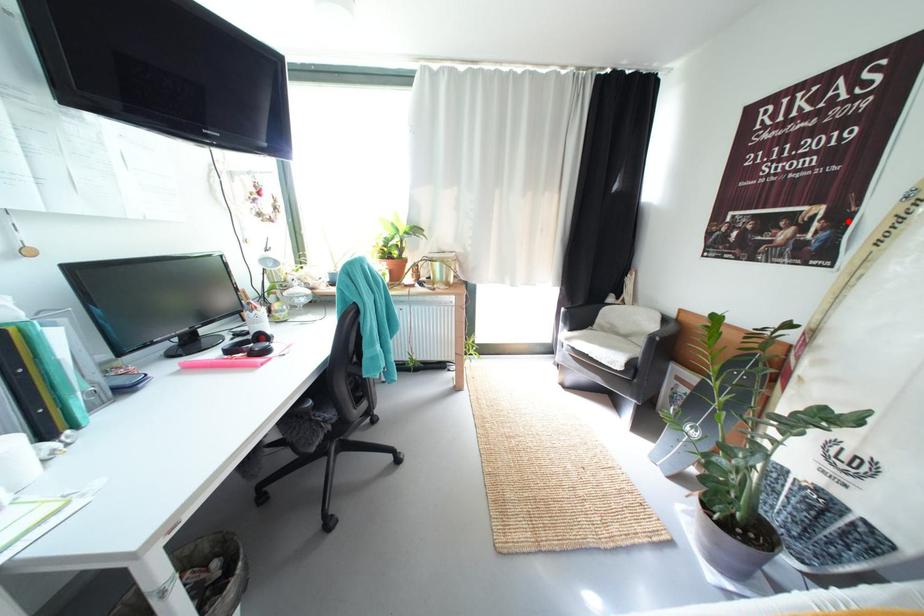
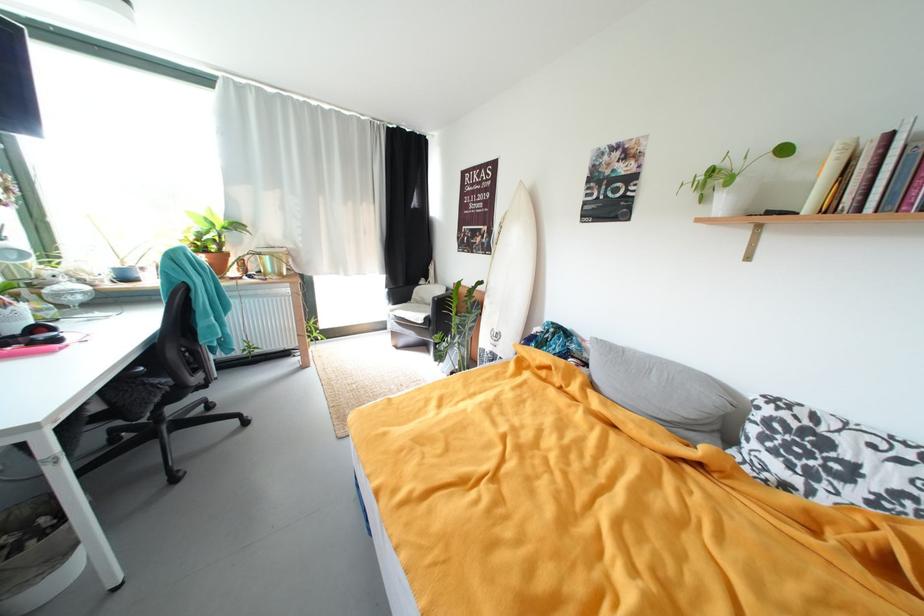
Locate, in the second image, the point that corresponds to the highlighted location in the first image.

(497, 235)